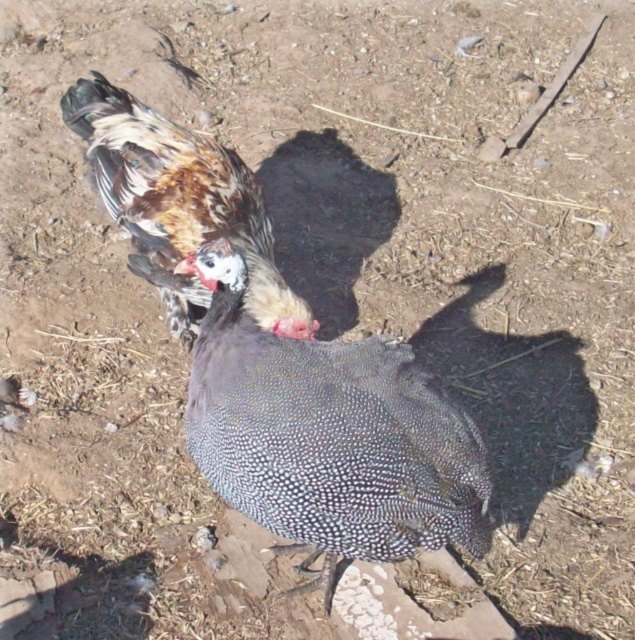
Question: Where is white speckled feather at center located in relation to speckled feathered chicken at center in the image?

Choices:
 (A) right
 (B) left

Answer: (A)

Question: Which object appears farthest from the camera in this image?

Choices:
 (A) speckled feathered chicken at center
 (B) white speckled feather at center

Answer: (A)

Question: Is white speckled feather at center thinner than speckled feathered chicken at center?

Choices:
 (A) no
 (B) yes

Answer: (B)

Question: Observing the image, what is the correct spatial positioning of white speckled feather at center in reference to speckled feathered chicken at center?

Choices:
 (A) right
 (B) left

Answer: (A)

Question: Which point appears closest to the camera in this image?

Choices:
 (A) (168, 298)
 (B) (472, 532)

Answer: (B)